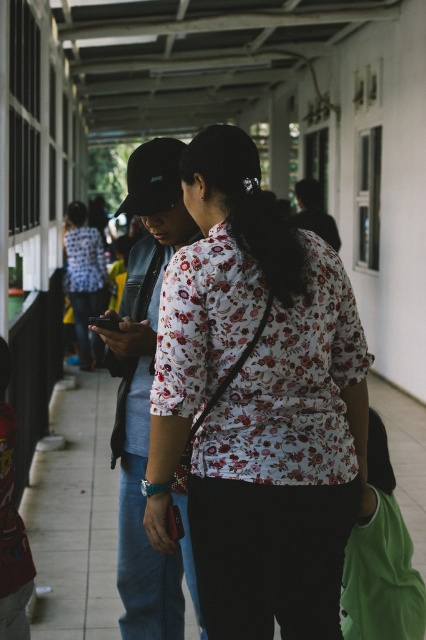
Is floral fabric shirt at center wider than green fabric bag at lower right?

Correct, the width of floral fabric shirt at center exceeds that of green fabric bag at lower right.

Does floral fabric shirt at center have a lesser width compared to green fabric bag at lower right?

No, floral fabric shirt at center is not thinner than green fabric bag at lower right.

Who is more distant from viewer, (175, 266) or (400, 547)?

Positioned behind is point (400, 547).

Find the location of a particular element. This screenshot has width=426, height=640. floral fabric shirt at center is located at coordinates (258, 404).

Does point (334, 582) lie behind point (184, 632)?

No, (334, 582) is closer to viewer.

In the scene shown: Measure the distance between point [284,509] and camera.

9.21 feet

This screenshot has width=426, height=640. I want to click on floral fabric shirt at center, so click(x=258, y=404).

I want to click on floral fabric shirt at center, so click(x=258, y=404).

Does point (60, 474) come behind point (356, 566)?

Yes, point (60, 474) is behind point (356, 566).

Is white tile pavement at center to the right of green fabric bag at lower right from the viewer's perspective?

Incorrect, white tile pavement at center is not on the right side of green fabric bag at lower right.

Who is more distant from viewer, (77, 490) or (379, 493)?

The point (77, 490) is behind.

In order to click on white tile pavement at center in this screenshot , I will do `click(75, 516)`.